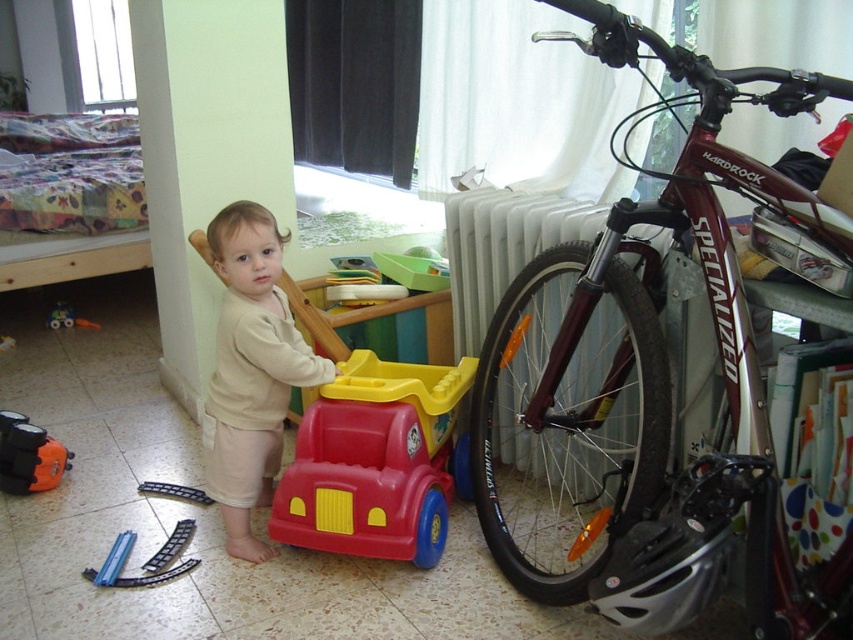
Does beige soft toddler at center lie in front of blue plastic toy car at lower left?

Yes, it is.

Can you confirm if beige soft toddler at center is shorter than blue plastic toy car at lower left?

No.

Locate an element on the screen. The image size is (853, 640). beige soft toddler at center is located at coordinates (250, 369).

Can you confirm if orange matte toy car at lower left is thinner than blue plastic toy car at lower left?

Yes, orange matte toy car at lower left is thinner than blue plastic toy car at lower left.

Who is more distant from viewer, [44,449] or [65,321]?

The point [65,321] is behind.

Does point (22, 472) come in front of point (68, 320)?

That is True.

Where is `orange matte toy car at lower left`? orange matte toy car at lower left is located at coordinates (28, 456).

Measure the distance between point (780,196) and camera.

The distance of point (780,196) from camera is 4.04 feet.

Is shiny metallic bicycle at right to the left of blue plastic toy car at lower left from the viewer's perspective?

Incorrect, shiny metallic bicycle at right is not on the left side of blue plastic toy car at lower left.

The width and height of the screenshot is (853, 640). Identify the location of shiny metallic bicycle at right. (653, 384).

Where is `shiny metallic bicycle at right`? The width and height of the screenshot is (853, 640). shiny metallic bicycle at right is located at coordinates (653, 384).